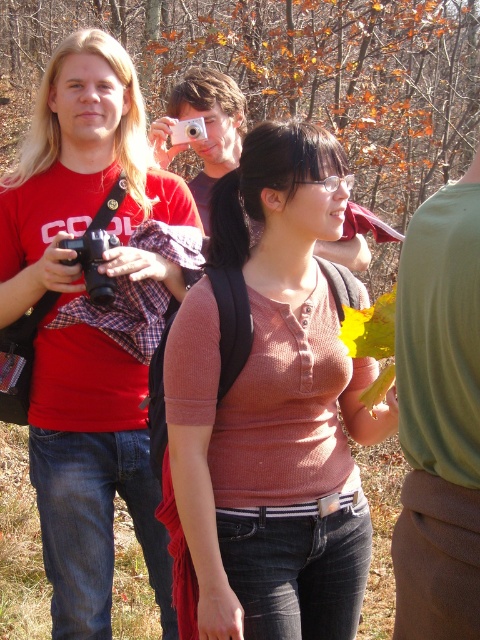
Question: Does matte black camera at left have a greater width compared to matte silver camera at upper center?

Choices:
 (A) no
 (B) yes

Answer: (B)

Question: Considering the real-world distances, which object is farthest from the pink knitted sweater at center?

Choices:
 (A) black plastic camera at left
 (B) matte black camera at left
 (C) silver metallic camera at center

Answer: (C)

Question: Which of the following is the closest to the observer?

Choices:
 (A) green fabric shirt at upper center
 (B) matte silver camera at upper center

Answer: (A)

Question: Can you confirm if matte silver camera at upper center is positioned above silver metallic camera at center?

Choices:
 (A) yes
 (B) no

Answer: (B)

Question: Is green fabric shirt at upper center in front of matte silver camera at upper center?

Choices:
 (A) no
 (B) yes

Answer: (B)

Question: Which object appears closest to the camera in this image?

Choices:
 (A) matte silver camera at upper center
 (B) pink knitted sweater at center

Answer: (B)